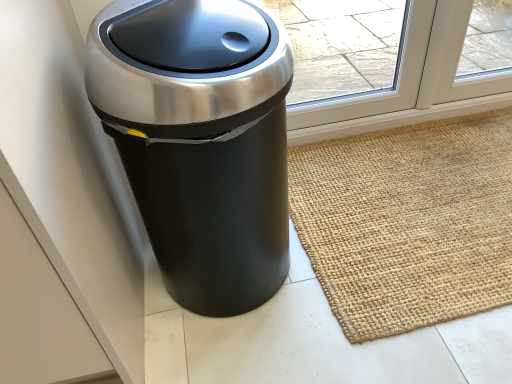
Question: Does satin black trash can at left have a greater width compared to natural jute doormat at lower right?

Choices:
 (A) yes
 (B) no

Answer: (B)

Question: Is the position of satin black trash can at left more distant than that of natural jute doormat at lower right?

Choices:
 (A) no
 (B) yes

Answer: (A)

Question: From the image's perspective, would you say satin black trash can at left is shown under natural jute doormat at lower right?

Choices:
 (A) no
 (B) yes

Answer: (A)

Question: Can you confirm if satin black trash can at left is shorter than natural jute doormat at lower right?

Choices:
 (A) yes
 (B) no

Answer: (B)

Question: Is natural jute doormat at lower right at the back of satin black trash can at left?

Choices:
 (A) yes
 (B) no

Answer: (B)

Question: Is satin black trash can at left in front of natural jute doormat at lower right?

Choices:
 (A) no
 (B) yes

Answer: (B)

Question: Does natural jute doormat at lower right appear on the right side of satin black trash can at left?

Choices:
 (A) yes
 (B) no

Answer: (A)

Question: Does natural jute doormat at lower right have a lesser width compared to satin black trash can at left?

Choices:
 (A) yes
 (B) no

Answer: (B)

Question: Can you see natural jute doormat at lower right touching satin black trash can at left?

Choices:
 (A) no
 (B) yes

Answer: (A)

Question: From the image's perspective, is natural jute doormat at lower right under satin black trash can at left?

Choices:
 (A) yes
 (B) no

Answer: (A)

Question: Is natural jute doormat at lower right smaller than satin black trash can at left?

Choices:
 (A) no
 (B) yes

Answer: (B)

Question: Is natural jute doormat at lower right bigger than satin black trash can at left?

Choices:
 (A) no
 (B) yes

Answer: (A)

Question: Is satin black trash can at left in front of or behind natural jute doormat at lower right in the image?

Choices:
 (A) behind
 (B) front

Answer: (B)